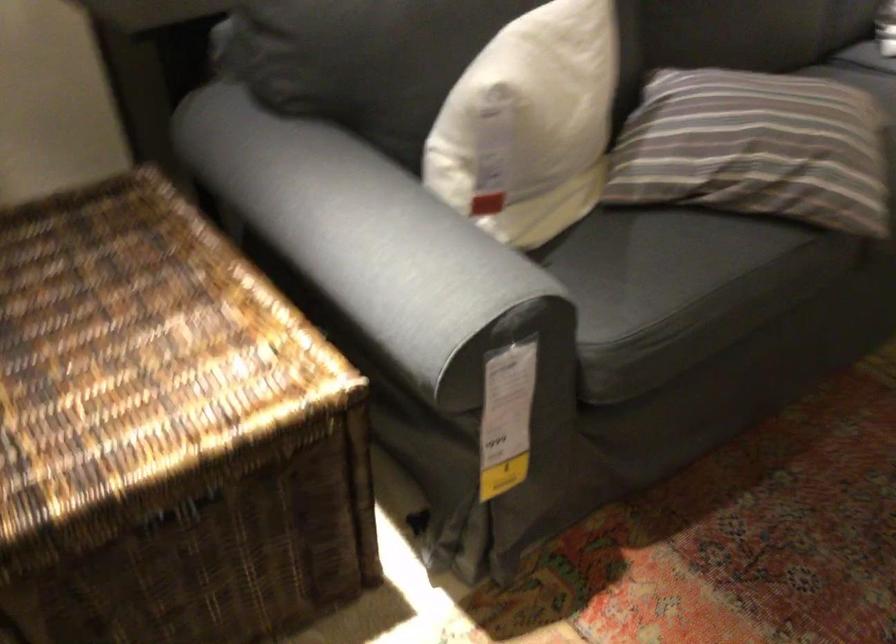
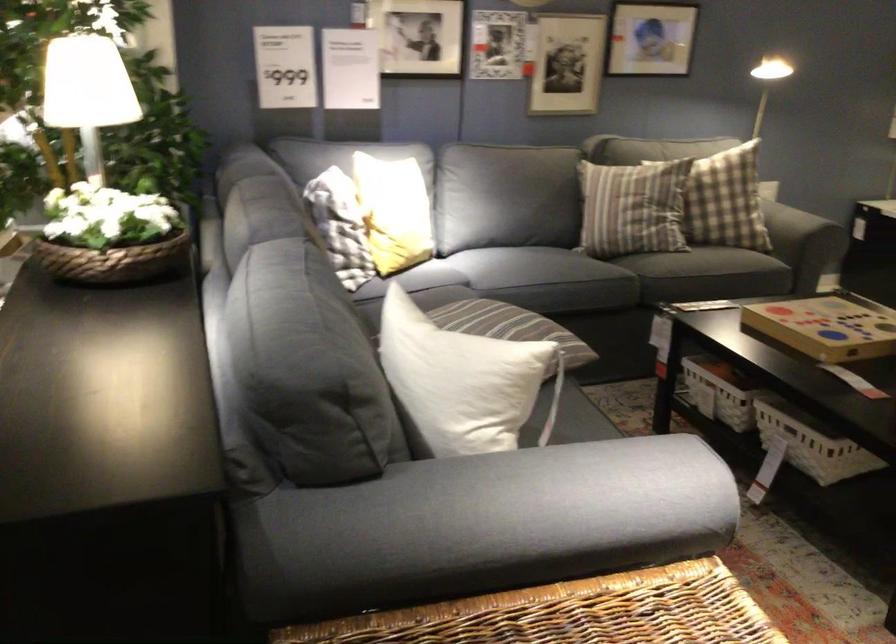
Find the pixel in the second image that matches (298,257) in the first image.

(528, 500)